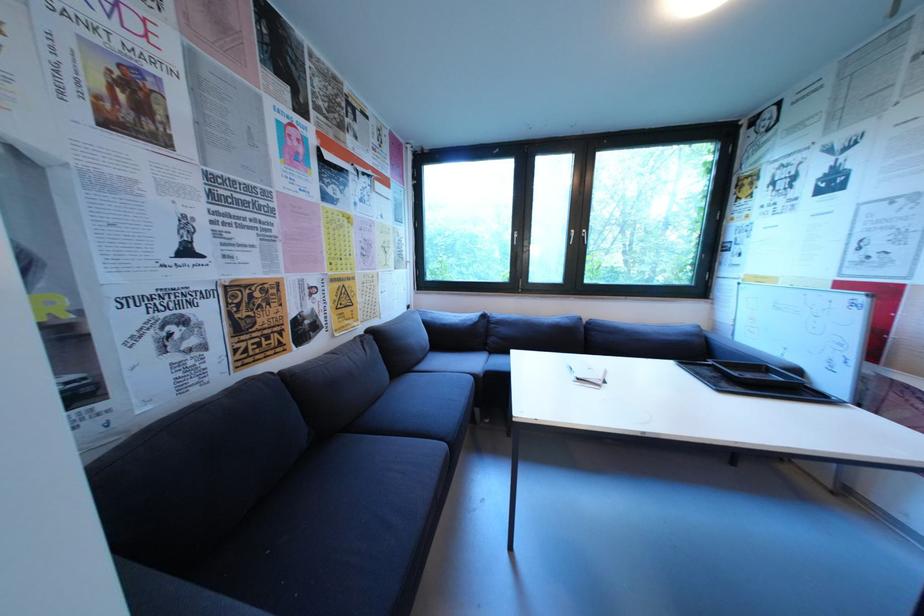
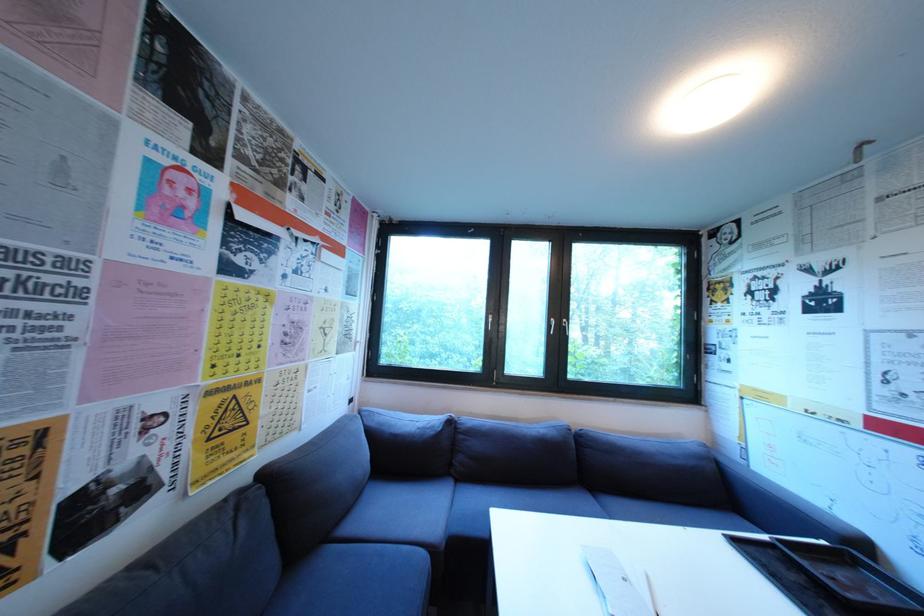
In the second image, find the point that corresponds to the point at 580,233 in the first image.

(560, 322)